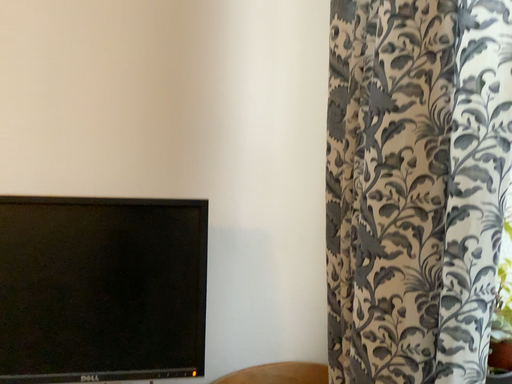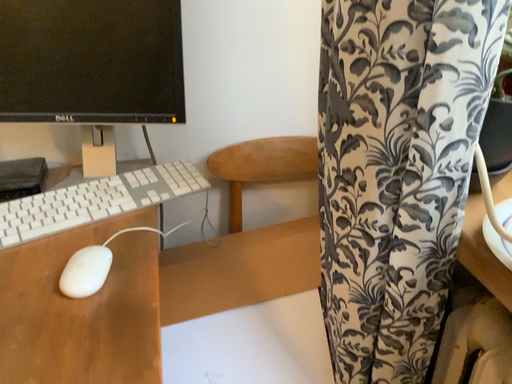
Question: How did the camera likely rotate when shooting the video?

Choices:
 (A) rotated left
 (B) rotated right

Answer: (A)